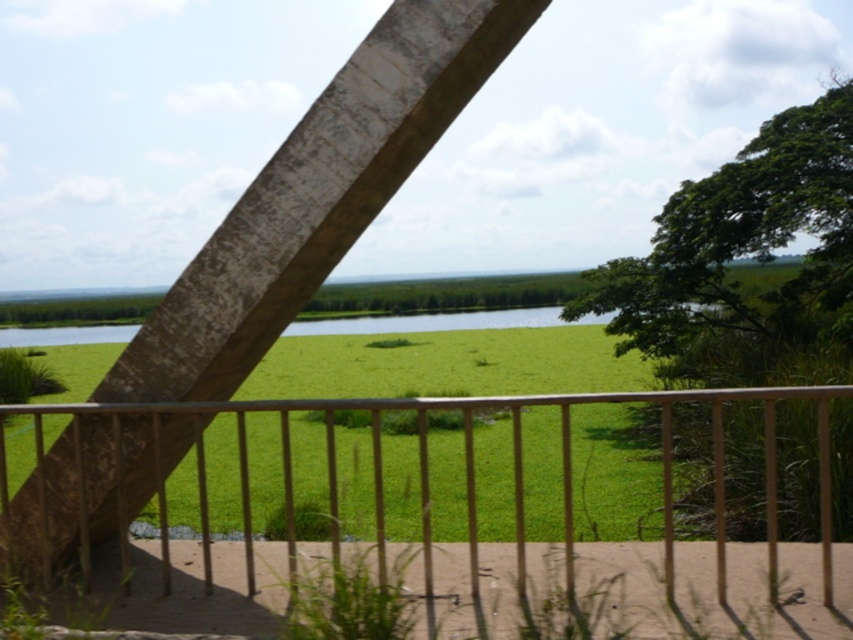
Where is `metallic silver balustrade at center`? Image resolution: width=853 pixels, height=640 pixels. metallic silver balustrade at center is located at coordinates (370, 477).